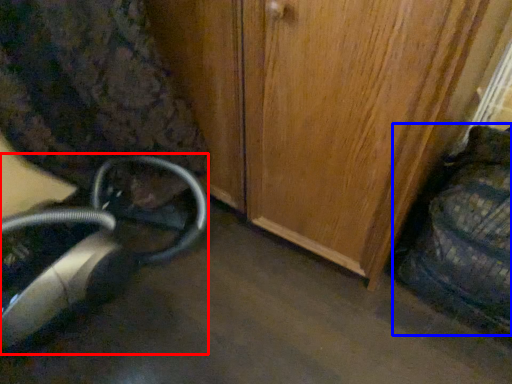
Question: Which object appears farthest to the camera in this image, equipment (highlighted by a red box) or swivel chair (highlighted by a blue box)?

Choices:
 (A) equipment
 (B) swivel chair

Answer: (A)